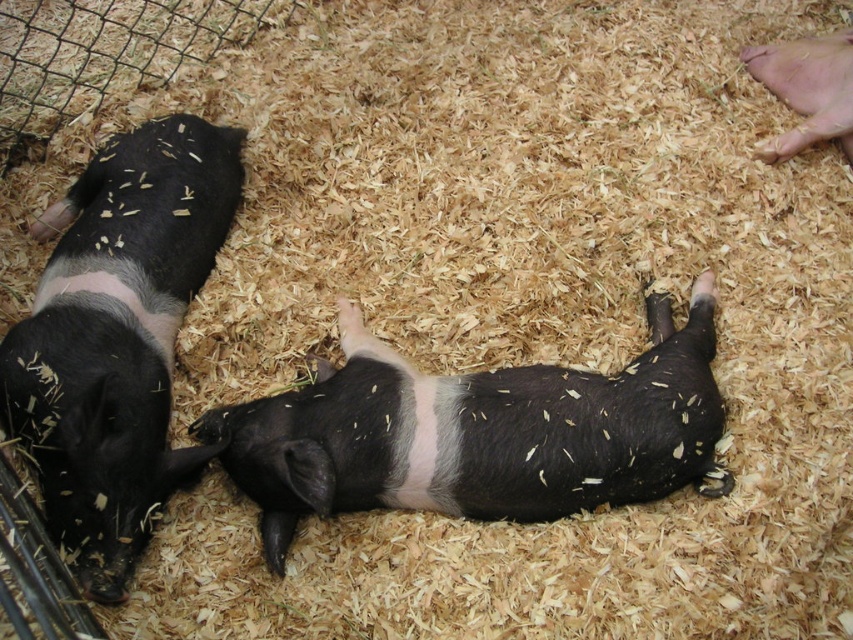
Question: Considering the relative positions of black matte pig at center and black matte pig at left in the image provided, where is black matte pig at center located with respect to black matte pig at left?

Choices:
 (A) below
 (B) above

Answer: (A)

Question: Which object appears farthest from the camera in this image?

Choices:
 (A) black matte pig at center
 (B) black matte pig at upper right
 (C) black matte pig at left

Answer: (B)

Question: Can you confirm if black matte pig at center is positioned above black matte pig at left?

Choices:
 (A) no
 (B) yes

Answer: (A)

Question: Which point is farther to the camera?

Choices:
 (A) black matte pig at upper right
 (B) black matte pig at left
 (C) black matte pig at center

Answer: (A)

Question: Which point is closer to the camera?

Choices:
 (A) (567, 400)
 (B) (845, 124)
 (C) (57, 388)

Answer: (C)

Question: Is black matte pig at center above black matte pig at left?

Choices:
 (A) yes
 (B) no

Answer: (B)